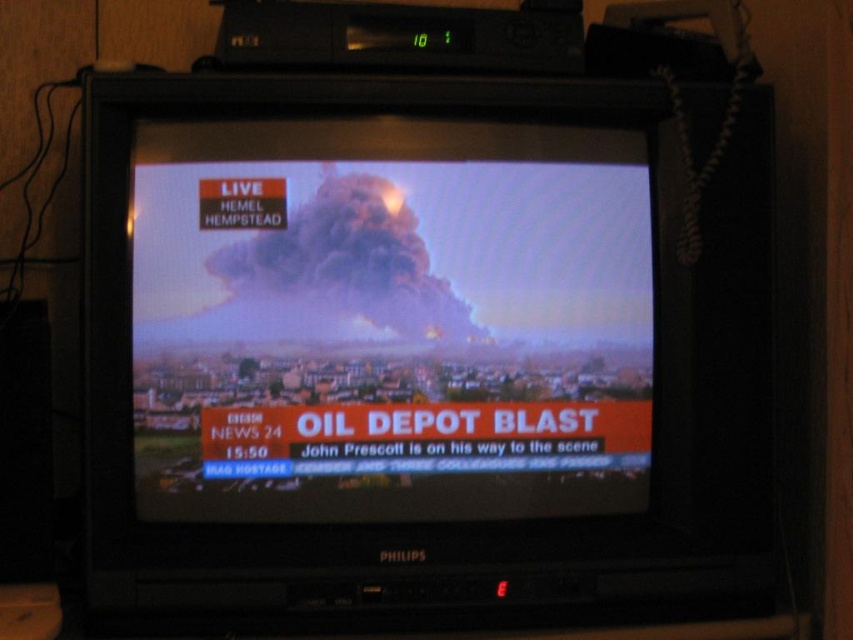
Consider the image. You are watching the news on the CRT television and notice a point marked at coordinates (389, 321). What does this point represent in the image?

The point at (389, 321) indicates the smoke cloud at center.